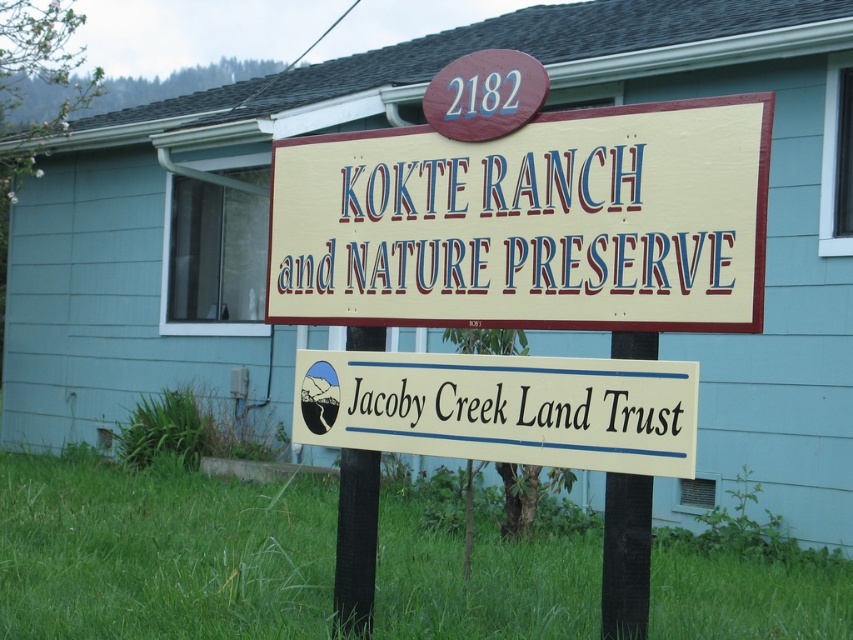
Which is below, beige wood sign at center or white painted wood jacoby creek land trust at center?

white painted wood jacoby creek land trust at center

Is point (676, 186) behind point (592, 464)?

No, it is in front of (592, 464).

Identify the location of beige wood sign at center. (529, 221).